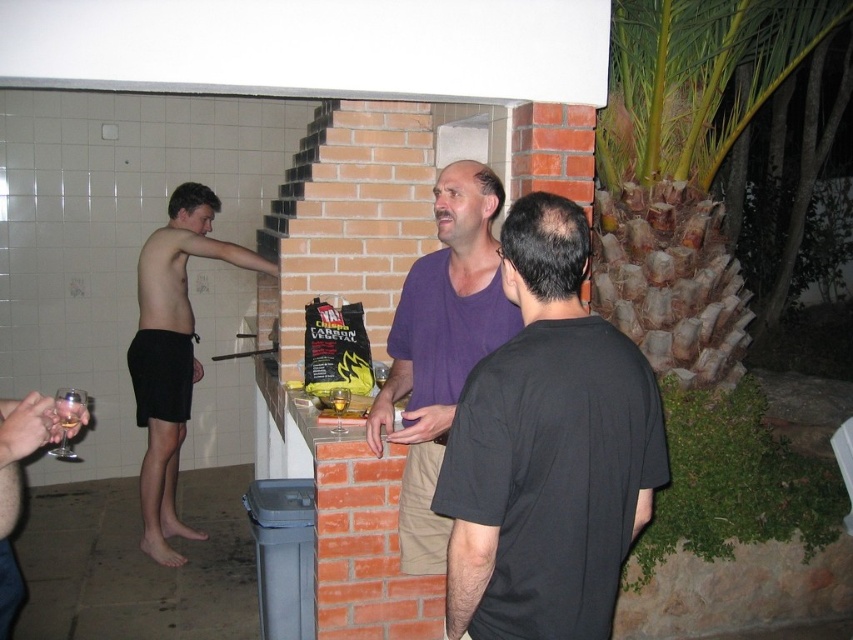
You are at the barbecue party and want to know which clothing item is smaller between the purple matte shirt at center and the black shorts at left. Can you tell me?

The purple matte shirt at center has a smaller size compared to black shorts at left, so the purple matte shirt at center is smaller.

Based on the photo, what object at the coordinates point (547, 449) is located in the center of the image?

The point (547, 449) corresponds to the purple matte shirt at center.